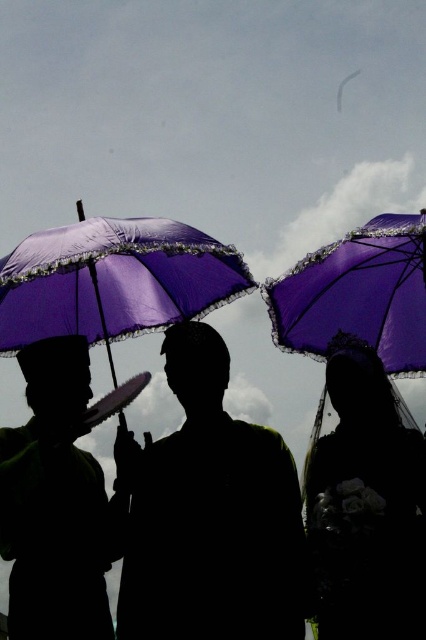
You are standing at the origin point in the image and want to reach the point at the bottom right corner. Which point, point 1 at coordinates (158, 518) or point 2 at coordinates (402, 332), is closer to your starting position?

Point 1 at coordinates (158, 518) is closer to the origin point than point 2 at coordinates (402, 332) because it has a smaller distance from the starting position.

You are an observer standing in front of the scene. You see the purple satin umbrella at left and the purple lace umbrella at upper right. Which umbrella is positioned more to the left side of the scene?

The purple satin umbrella at left is positioned more to the left side of the scene than the purple lace umbrella at upper right.

You are a photographer trying to capture a group photo of the three people under the purple satin umbrella at left and the other two individuals. Since the umbrellas are partially obscuring the figures, how far apart should you position the subjects to ensure their faces are fully visible without any obstruction?

The purple satin umbrella at left is 40.36 meters away from the other individuals. To ensure their faces are visible without obstruction, the subjects should be positioned at least 40.36 meters apart so the umbrellas don